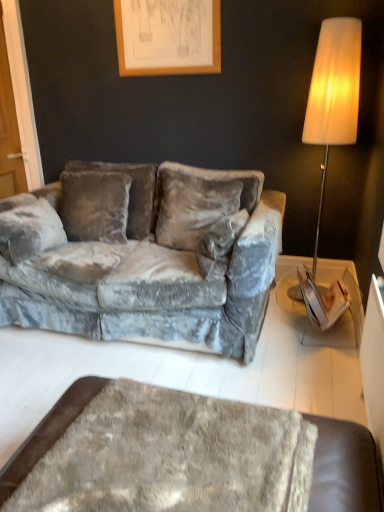
Question: Is velvet gray couch at center situated inside wooden picture frame at upper center or outside?

Choices:
 (A) inside
 (B) outside

Answer: (B)

Question: From a real-world perspective, is velvet gray couch at center positioned above or below wooden picture frame at upper center?

Choices:
 (A) below
 (B) above

Answer: (A)

Question: Which object is positioned farthest from the velvet gray couch at center?

Choices:
 (A) wooden picture frame at upper center
 (B) fuzzy brown ottoman at lower center

Answer: (B)

Question: Which is nearer to the wooden picture frame at upper center?

Choices:
 (A) velvet gray couch at center
 (B) fuzzy brown ottoman at lower center

Answer: (A)